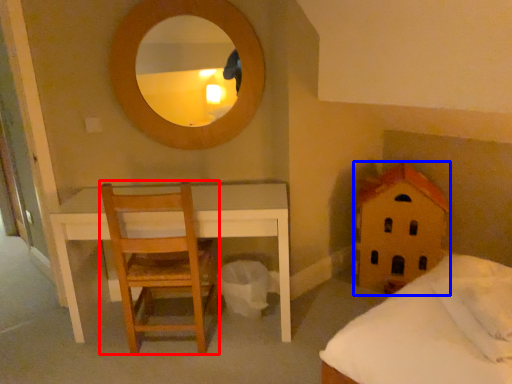
Question: Which object appears farthest to the camera in this image, chair (highlighted by a red box) or toy (highlighted by a blue box)?

Choices:
 (A) chair
 (B) toy

Answer: (B)